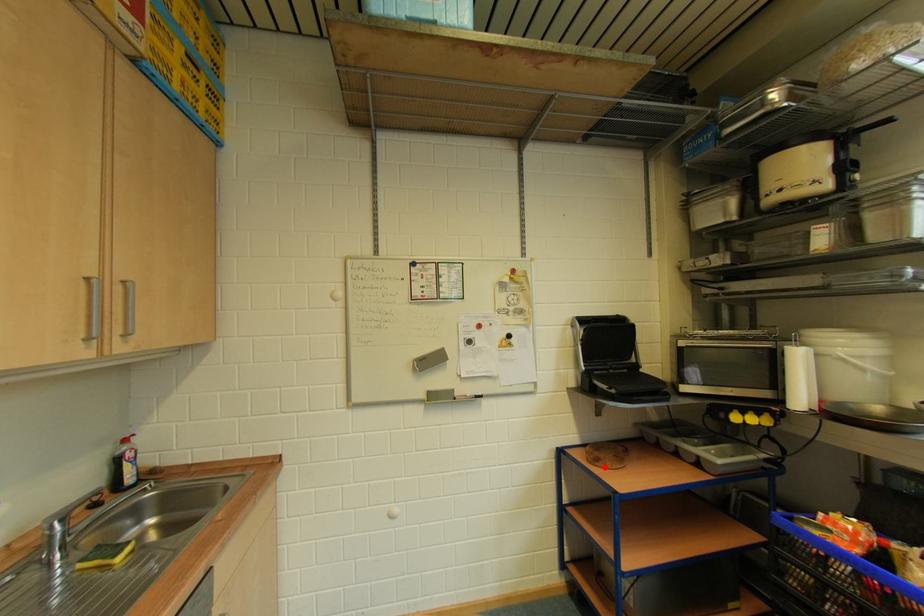
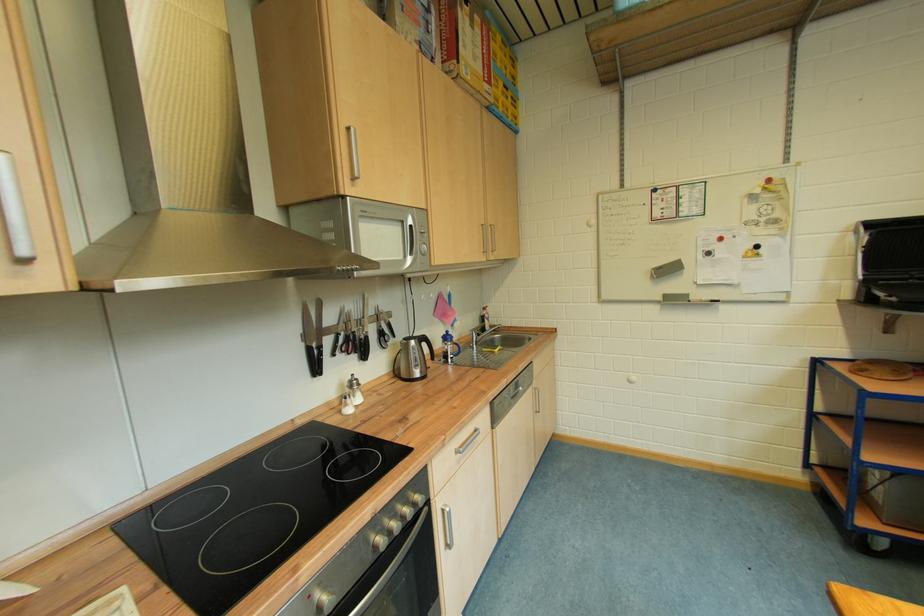
In the second image, find the point that corresponds to the highlighted location in the first image.

(868, 377)